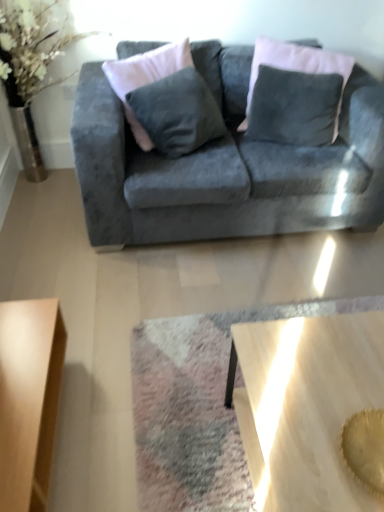
Describe the element at coordinates (29, 399) in the screenshot. The width and height of the screenshot is (384, 512). I see `light brown wooden coffee table at lower left, which ranks as the 2th coffee table in right-to-left order` at that location.

Where is `light brown wooden coffee table at lower left, which ranks as the 2th coffee table in right-to-left order`? light brown wooden coffee table at lower left, which ranks as the 2th coffee table in right-to-left order is located at coordinates (29, 399).

Is light brown wooden coffee table at lower left, which ranks as the 2th coffee table in right-to-left order, facing towards velvet gray couch at center?

No, light brown wooden coffee table at lower left, which ranks as the 2th coffee table in right-to-left order, is not oriented towards velvet gray couch at center.

The width and height of the screenshot is (384, 512). What are the coordinates of `studio couch that is behind the light brown wooden coffee table at lower left, the first coffee table viewed from the left` in the screenshot? It's located at (225, 166).

How different are the orientations of light brown wooden coffee table at lower left, the first coffee table viewed from the left, and velvet gray couch at center in degrees?

The facing directions of light brown wooden coffee table at lower left, the first coffee table viewed from the left, and velvet gray couch at center are 89.5 degrees apart.

From a real-world perspective, is light brown wooden coffee table at lower left, which ranks as the 2th coffee table in right-to-left order, physically located above or below velvet gray couch at center?

From a real-world perspective, light brown wooden coffee table at lower left, which ranks as the 2th coffee table in right-to-left order, is physically below velvet gray couch at center.

Choose the correct answer: Is light brown wooden coffee table at lower left, the first coffee table viewed from the left, inside velvet dark gray pillow at upper center or outside it?

light brown wooden coffee table at lower left, the first coffee table viewed from the left, lies outside velvet dark gray pillow at upper center.

Which coffee table is the 2nd one when counting from the left side of the velvet dark gray pillow at upper center? Please provide its 2D coordinates.

[(29, 399)]

Is light brown wooden coffee table at lower left, the first coffee table viewed from the left, far away from velvet dark gray pillow at upper center?

Indeed, light brown wooden coffee table at lower left, the first coffee table viewed from the left, is not near velvet dark gray pillow at upper center.

Can you confirm if light brown wooden coffee table at lower left, the first coffee table viewed from the left, is wider than velvet dark gray pillow at upper center?

Yes.

Considering the relative positions of velvet gray couch at center and wooden polished coffee table at lower center, arranged as the second coffee table when viewed from the left, in the image provided, is velvet gray couch at center behind wooden polished coffee table at lower center, arranged as the second coffee table when viewed from the left,?

Yes.

Which object is positioned more to the left, velvet gray couch at center or wooden polished coffee table at lower center, which is the 1th coffee table from right to left?

From the viewer's perspective, velvet gray couch at center appears more on the left side.

From a real-world perspective, which object stands above the other?

From a 3D spatial view, velvet gray couch at center is above.

Considering the sizes of velvet gray couch at center and wooden polished coffee table at lower center, which is the 1th coffee table from right to left, in the image, is velvet gray couch at center taller or shorter than wooden polished coffee table at lower center, which is the 1th coffee table from right to left,?

In the image, velvet gray couch at center appears to be taller than wooden polished coffee table at lower center, which is the 1th coffee table from right to left.

Who is bigger, velvet dark gray pillow at upper center or velvet gray couch at center?

velvet gray couch at center is bigger.

Which object is closer to the camera taking this photo, velvet dark gray pillow at upper center or velvet gray couch at center?

velvet gray couch at center is more forward.

Considering the sizes of objects velvet dark gray pillow at upper center and velvet gray couch at center in the image provided, who is taller, velvet dark gray pillow at upper center or velvet gray couch at center?

velvet gray couch at center.

Identify the location of pillow above the velvet gray couch at center (from the image's perspective). The width and height of the screenshot is (384, 512). (297, 69).

How different are the orientations of velvet dark gray pillow at upper center and wooden polished coffee table at lower center, which is the 1th coffee table from right to left, in degrees?

There is a 68.4-degree angle between the facing directions of velvet dark gray pillow at upper center and wooden polished coffee table at lower center, which is the 1th coffee table from right to left.

Which object is further away from the camera taking this photo, velvet dark gray pillow at upper center or wooden polished coffee table at lower center, which is the 1th coffee table from right to left?

velvet dark gray pillow at upper center.

From the image's perspective, is velvet dark gray pillow at upper center below wooden polished coffee table at lower center, which is the 1th coffee table from right to left?

Actually, velvet dark gray pillow at upper center appears above wooden polished coffee table at lower center, which is the 1th coffee table from right to left, in the image.

Who is taller, velvet dark gray pillow at upper center or wooden polished coffee table at lower center, arranged as the second coffee table when viewed from the left?

velvet dark gray pillow at upper center.

How many degrees apart are the facing directions of velvet dark gray pillow at upper center and light brown wooden coffee table at lower left, the first coffee table viewed from the left?

The angular difference between velvet dark gray pillow at upper center and light brown wooden coffee table at lower left, the first coffee table viewed from the left, is 111 degrees.

From a real-world perspective, is velvet dark gray pillow at upper center below light brown wooden coffee table at lower left, the first coffee table viewed from the left?

No, from a real-world perspective, velvet dark gray pillow at upper center is not under light brown wooden coffee table at lower left, the first coffee table viewed from the left.

Considering the sizes of objects velvet dark gray pillow at upper center and light brown wooden coffee table at lower left, which ranks as the 2th coffee table in right-to-left order, in the image provided, who is shorter, velvet dark gray pillow at upper center or light brown wooden coffee table at lower left, which ranks as the 2th coffee table in right-to-left order,?

light brown wooden coffee table at lower left, which ranks as the 2th coffee table in right-to-left order, is shorter.

Which is more to the left, velvet dark gray pillow at upper center or light brown wooden coffee table at lower left, the first coffee table viewed from the left?

light brown wooden coffee table at lower left, the first coffee table viewed from the left.

Is wooden polished coffee table at lower center, arranged as the second coffee table when viewed from the left, shorter than light brown wooden coffee table at lower left, which ranks as the 2th coffee table in right-to-left order?

No, wooden polished coffee table at lower center, arranged as the second coffee table when viewed from the left, is not shorter than light brown wooden coffee table at lower left, which ranks as the 2th coffee table in right-to-left order.

Locate an element on the screen. This screenshot has height=512, width=384. coffee table on the right side of light brown wooden coffee table at lower left, which ranks as the 2th coffee table in right-to-left order is located at coordinates coord(306,406).

Is point (309, 418) behind point (57, 321)?

No, it is not.

From a real-world perspective, who is located higher, wooden polished coffee table at lower center, arranged as the second coffee table when viewed from the left, or light brown wooden coffee table at lower left, the first coffee table viewed from the left?

wooden polished coffee table at lower center, arranged as the second coffee table when viewed from the left.

Locate an element on the screen. Image resolution: width=384 pixels, height=512 pixels. studio couch that appears above the light brown wooden coffee table at lower left, which ranks as the 2th coffee table in right-to-left order (from a real-world perspective) is located at coordinates (225, 166).

I want to click on the 2nd coffee table to the left of the velvet dark gray pillow at upper center, starting your count from the anchor, so click(x=29, y=399).

Which object lies nearer to the anchor point velvet dark gray pillow at upper center, light brown wooden coffee table at lower left, which ranks as the 2th coffee table in right-to-left order, or velvet gray couch at center?

velvet gray couch at center lies closer to velvet dark gray pillow at upper center than the other object.

From the image, which object appears to be nearer to light brown wooden coffee table at lower left, which ranks as the 2th coffee table in right-to-left order, velvet gray couch at center or wooden polished coffee table at lower center, arranged as the second coffee table when viewed from the left?

wooden polished coffee table at lower center, arranged as the second coffee table when viewed from the left, lies closer to light brown wooden coffee table at lower left, which ranks as the 2th coffee table in right-to-left order, than the other object.

Which object lies further to the anchor point light brown wooden coffee table at lower left, which ranks as the 2th coffee table in right-to-left order, wooden polished coffee table at lower center, which is the 1th coffee table from right to left, or velvet gray couch at center?

Answer: velvet gray couch at center is positioned further to the anchor light brown wooden coffee table at lower left, which ranks as the 2th coffee table in right-to-left order.

Estimate the real-world distances between objects in this image. Which object is further from wooden polished coffee table at lower center, arranged as the second coffee table when viewed from the left, velvet gray couch at center or velvet dark gray pillow at upper center?

The object further to wooden polished coffee table at lower center, arranged as the second coffee table when viewed from the left, is velvet dark gray pillow at upper center.

Estimate the real-world distances between objects in this image. Which object is closer to wooden polished coffee table at lower center, which is the 1th coffee table from right to left, velvet gray couch at center or light brown wooden coffee table at lower left, which ranks as the 2th coffee table in right-to-left order?

light brown wooden coffee table at lower left, which ranks as the 2th coffee table in right-to-left order.

Looking at the image, which one is located further to velvet gray couch at center, wooden polished coffee table at lower center, arranged as the second coffee table when viewed from the left, or light brown wooden coffee table at lower left, the first coffee table viewed from the left?

The object further to velvet gray couch at center is wooden polished coffee table at lower center, arranged as the second coffee table when viewed from the left.

Estimate the real-world distances between objects in this image. Which object is closer to velvet gray couch at center, wooden polished coffee table at lower center, which is the 1th coffee table from right to left, or velvet dark gray pillow at upper center?

velvet dark gray pillow at upper center is closer to velvet gray couch at center.

Based on their spatial positions, is wooden polished coffee table at lower center, which is the 1th coffee table from right to left, or light brown wooden coffee table at lower left, the first coffee table viewed from the left, further from velvet dark gray pillow at upper center?

light brown wooden coffee table at lower left, the first coffee table viewed from the left, lies further to velvet dark gray pillow at upper center than the other object.

The width and height of the screenshot is (384, 512). What are the coordinates of `studio couch between velvet dark gray pillow at upper center and wooden polished coffee table at lower center, arranged as the second coffee table when viewed from the left, from top to bottom` in the screenshot? It's located at (225, 166).

The width and height of the screenshot is (384, 512). Identify the location of coffee table between velvet gray couch at center and wooden polished coffee table at lower center, arranged as the second coffee table when viewed from the left, in the vertical direction. (29, 399).

The height and width of the screenshot is (512, 384). Find the location of `coffee table that lies between velvet dark gray pillow at upper center and wooden polished coffee table at lower center, which is the 1th coffee table from right to left, from top to bottom`. coffee table that lies between velvet dark gray pillow at upper center and wooden polished coffee table at lower center, which is the 1th coffee table from right to left, from top to bottom is located at coordinates (29, 399).

What are the coordinates of `studio couch between velvet dark gray pillow at upper center and light brown wooden coffee table at lower left, the first coffee table viewed from the left, vertically` in the screenshot? It's located at (225, 166).